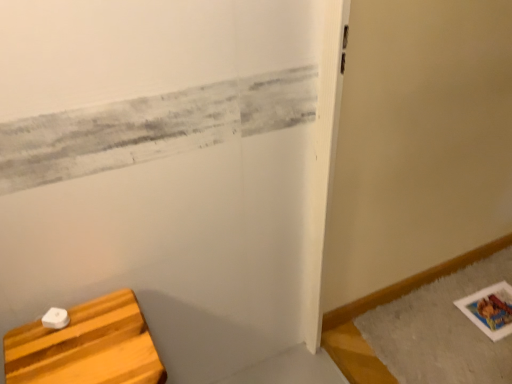
You are a GUI agent. You are given a task and a screenshot of the screen. Output one action in this format:
    pyautogui.click(x=<x>, y=<y>)
    Task: Click on the white matte wood cutting board at lower left
    The height and width of the screenshot is (384, 512).
    Given the screenshot: What is the action you would take?
    [87, 347]

The height and width of the screenshot is (384, 512). What do you see at coordinates (87, 347) in the screenshot?
I see `white matte wood cutting board at lower left` at bounding box center [87, 347].

Measure the distance between point (456,349) and camera.

Point (456,349) is 1.58 meters away from camera.

The width and height of the screenshot is (512, 384). What do you see at coordinates (441, 330) in the screenshot?
I see `gray fluffy bath mat at lower right` at bounding box center [441, 330].

Find the location of `gray fluffy bath mat at lower right`. gray fluffy bath mat at lower right is located at coordinates point(441,330).

Where is `white matte wood cutting board at lower left`? The image size is (512, 384). white matte wood cutting board at lower left is located at coordinates (87, 347).

In the image, is white matte wood cutting board at lower left on the left side or the right side of gray fluffy bath mat at lower right?

In the image, white matte wood cutting board at lower left appears on the left side of gray fluffy bath mat at lower right.

Considering the positions of objects white matte wood cutting board at lower left and gray fluffy bath mat at lower right in the image provided, who is behind, white matte wood cutting board at lower left or gray fluffy bath mat at lower right?

gray fluffy bath mat at lower right.

Considering the points (108, 309) and (457, 329), which point is in front, point (108, 309) or point (457, 329)?

Point (108, 309)

From the image's perspective, which is below, white matte wood cutting board at lower left or gray fluffy bath mat at lower right?

From the image's view, white matte wood cutting board at lower left is below.

From a real-world perspective, is white matte wood cutting board at lower left located beneath gray fluffy bath mat at lower right?

No, from a real-world perspective, white matte wood cutting board at lower left is not beneath gray fluffy bath mat at lower right.

Which object is thinner, white matte wood cutting board at lower left or gray fluffy bath mat at lower right?

white matte wood cutting board at lower left.

Consider the image. Who is shorter, white matte wood cutting board at lower left or gray fluffy bath mat at lower right?

Standing shorter between the two is gray fluffy bath mat at lower right.

Does white matte wood cutting board at lower left have a larger size compared to gray fluffy bath mat at lower right?

Correct, white matte wood cutting board at lower left is larger in size than gray fluffy bath mat at lower right.

Is white matte wood cutting board at lower left inside the boundaries of gray fluffy bath mat at lower right, or outside?

white matte wood cutting board at lower left cannot be found inside gray fluffy bath mat at lower right.

Is white matte wood cutting board at lower left positioned far away from gray fluffy bath mat at lower right?

Absolutely, white matte wood cutting board at lower left is distant from gray fluffy bath mat at lower right.

Is white matte wood cutting board at lower left positioned with its back to gray fluffy bath mat at lower right?

That's not correct — white matte wood cutting board at lower left is not looking away from gray fluffy bath mat at lower right.

Measure the distance from white matte wood cutting board at lower left to gray fluffy bath mat at lower right.

white matte wood cutting board at lower left is 1.14 meters from gray fluffy bath mat at lower right.

I want to click on bath mat on the right of the white matte wood cutting board at lower left, so click(441, 330).

Is gray fluffy bath mat at lower right at the left side of white matte wood cutting board at lower left?

No, gray fluffy bath mat at lower right is not to the left of white matte wood cutting board at lower left.

Relative to white matte wood cutting board at lower left, is gray fluffy bath mat at lower right in front or behind?

gray fluffy bath mat at lower right is positioned farther from the viewer than white matte wood cutting board at lower left.

Is point (484, 377) closer or farther from the camera than point (75, 313)?

Point (484, 377).

From the image's perspective, is gray fluffy bath mat at lower right positioned above or below white matte wood cutting board at lower left?

Based on their image positions, gray fluffy bath mat at lower right is located above white matte wood cutting board at lower left.

From a real-world perspective, is gray fluffy bath mat at lower right positioned above or below white matte wood cutting board at lower left?

gray fluffy bath mat at lower right is below white matte wood cutting board at lower left.

Is gray fluffy bath mat at lower right thinner than white matte wood cutting board at lower left?

No, gray fluffy bath mat at lower right is not thinner than white matte wood cutting board at lower left.

Consider the image. Between gray fluffy bath mat at lower right and white matte wood cutting board at lower left, which one has less height?

gray fluffy bath mat at lower right is shorter.

Can you confirm if gray fluffy bath mat at lower right is smaller than white matte wood cutting board at lower left?

Yes, gray fluffy bath mat at lower right is smaller than white matte wood cutting board at lower left.

Could white matte wood cutting board at lower left be considered to be inside gray fluffy bath mat at lower right?

No, gray fluffy bath mat at lower right does not contain white matte wood cutting board at lower left.

Does gray fluffy bath mat at lower right touch white matte wood cutting board at lower left?

No, gray fluffy bath mat at lower right is not beside white matte wood cutting board at lower left.

Is gray fluffy bath mat at lower right oriented towards white matte wood cutting board at lower left?

No, gray fluffy bath mat at lower right is not turned towards white matte wood cutting board at lower left.

How different are the orientations of gray fluffy bath mat at lower right and white matte wood cutting board at lower left in degrees?

The angle between the facing direction of gray fluffy bath mat at lower right and the facing direction of white matte wood cutting board at lower left is 89.1 degrees.

This screenshot has width=512, height=384. Find the location of `furniture that is above the gray fluffy bath mat at lower right (from a real-world perspective)`. furniture that is above the gray fluffy bath mat at lower right (from a real-world perspective) is located at coordinates (87, 347).

This screenshot has width=512, height=384. I want to click on bath mat directly beneath the white matte wood cutting board at lower left (from a real-world perspective), so click(x=441, y=330).

The image size is (512, 384). In order to click on furniture to the left of gray fluffy bath mat at lower right in this screenshot , I will do `click(87, 347)`.